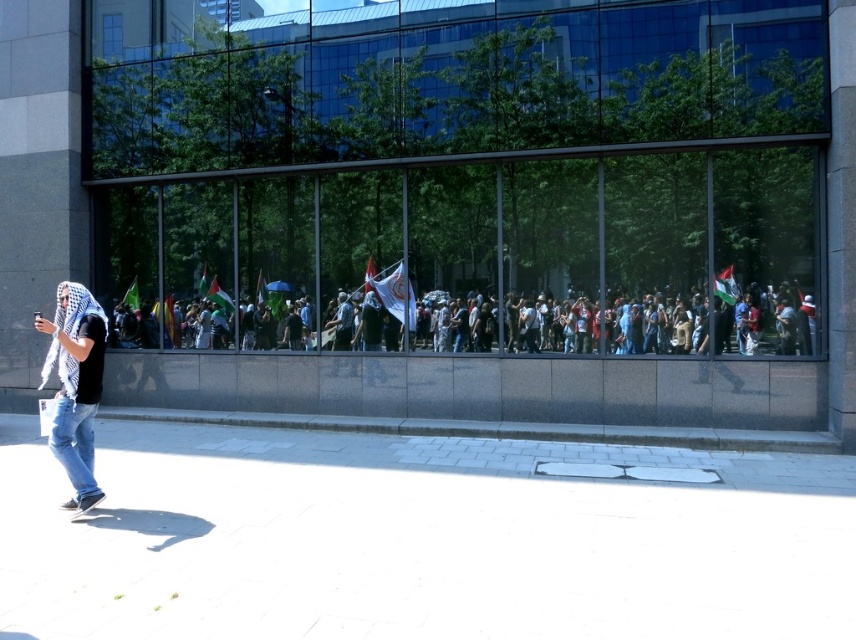
From the picture: Can you confirm if multicolored flags at center is bigger than white checkered scarf at left?

Actually, multicolored flags at center might be smaller than white checkered scarf at left.

What do you see at coordinates (682, 321) in the screenshot?
I see `multicolored flags at center` at bounding box center [682, 321].

Identify the location of multicolored flags at center. The width and height of the screenshot is (856, 640). (682, 321).

Is point (777, 534) closer to viewer compared to point (64, 433)?

Yes, point (777, 534) is in front of point (64, 433).

Who is more distant from viewer, (274,483) or (66,428)?

The point (274,483) is more distant.

Describe the element at coordinates (418, 540) in the screenshot. I see `white concrete pavement at lower left` at that location.

Identify the location of white concrete pavement at lower left. The height and width of the screenshot is (640, 856). (418, 540).

Who is more forward, (758, 596) or (565, 330)?

Positioned in front is point (758, 596).

Is the position of white concrete pavement at lower left less distant than that of multicolored flags at center?

That is True.

You are a GUI agent. You are given a task and a screenshot of the screen. Output one action in this format:
    pyautogui.click(x=<x>, y=<y>)
    Task: Click on the white concrete pavement at lower left
    
    Given the screenshot: What is the action you would take?
    pyautogui.click(x=418, y=540)